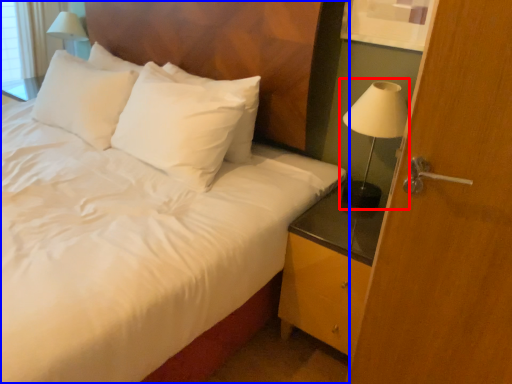
Question: Which point is closer to the camera, bedside lamp (highlighted by a red box) or bed (highlighted by a blue box)?

Choices:
 (A) bedside lamp
 (B) bed

Answer: (B)